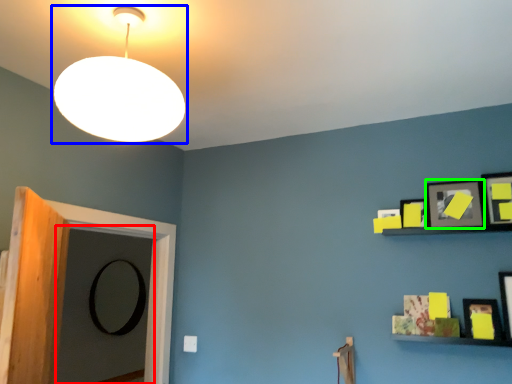
Question: Considering the real-world distances, which object is farthest from door (highlighted by a red box)? lamp (highlighted by a blue box) or picture frame (highlighted by a green box)?

Choices:
 (A) lamp
 (B) picture frame

Answer: (B)